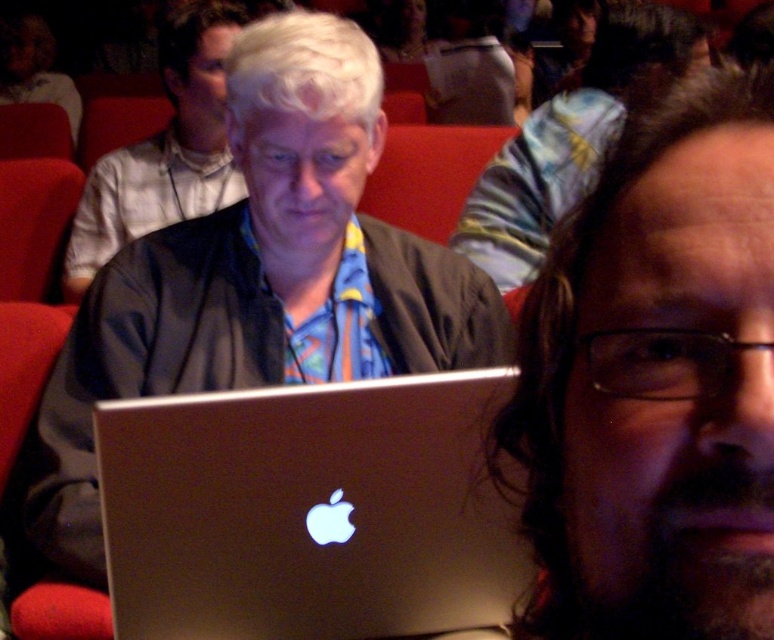
Where is `striped shirt at center`? striped shirt at center is located at coordinates (570, 140).

Is striped shirt at center thinner than blue patterned scarf at center?

In fact, striped shirt at center might be wider than blue patterned scarf at center.

Where is `striped shirt at center`? striped shirt at center is located at coordinates (570, 140).

Who is higher up, dark brown hair at center or striped shirt at center?

striped shirt at center

Between dark brown hair at center and striped shirt at center, which one appears on the left side from the viewer's perspective?

dark brown hair at center

The width and height of the screenshot is (774, 640). I want to click on dark brown hair at center, so (653, 378).

Is silver metallic laptop at center above striped shirt at center?

Actually, silver metallic laptop at center is below striped shirt at center.

What do you see at coordinates (310, 513) in the screenshot?
I see `silver metallic laptop at center` at bounding box center [310, 513].

Who is more distant from viewer, [149,435] or [598,74]?

The point [598,74] is behind.

Where is `silver metallic laptop at center`? Image resolution: width=774 pixels, height=640 pixels. silver metallic laptop at center is located at coordinates (310, 513).